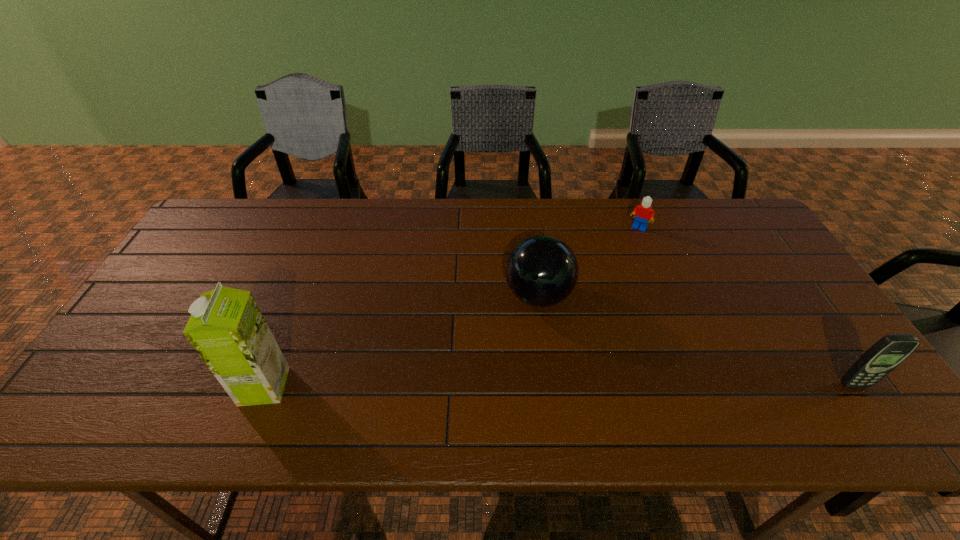
I want to click on empty location between the cellular telephone and the third nearest object, so click(696, 340).

Locate an element on the screen. The width and height of the screenshot is (960, 540). free space that is in between the soya milk and the Lego is located at coordinates (451, 307).

Find the location of a particular element. Image resolution: width=960 pixels, height=540 pixels. free space between the leftmost object and the second object from left to right is located at coordinates (401, 341).

Locate an element on the screen. vacant space that's between the soya milk and the bowling ball is located at coordinates (401, 341).

At what (x,y) coordinates should I click in order to perform the action: click on vacant point located between the Lego and the tallest object. Please return your answer as a coordinate pair (x, y). This screenshot has height=540, width=960. Looking at the image, I should click on (451, 307).

Identify which object is located as the nearest to the Lego. Please provide its 2D coordinates. Your answer should be formatted as a tuple, i.e. [(x, y)], where the tuple contains the x and y coordinates of a point satisfying the conditions above.

[(541, 271)]

Locate which object ranks second in proximity to the tallest object. Please provide its 2D coordinates. Your answer should be formatted as a tuple, i.e. [(x, y)], where the tuple contains the x and y coordinates of a point satisfying the conditions above.

[(642, 213)]

Locate an element on the screen. This screenshot has height=540, width=960. blank space that satisfies the following two spatial constraints: 1. on the back side of the bowling ball; 2. on the left side of the shortest object is located at coordinates (530, 227).

Where is `vacant area that satisfies the following two spatial constraints: 1. on the back side of the leftmost object; 2. on the left side of the second object from left to right`? vacant area that satisfies the following two spatial constraints: 1. on the back side of the leftmost object; 2. on the left side of the second object from left to right is located at coordinates (300, 296).